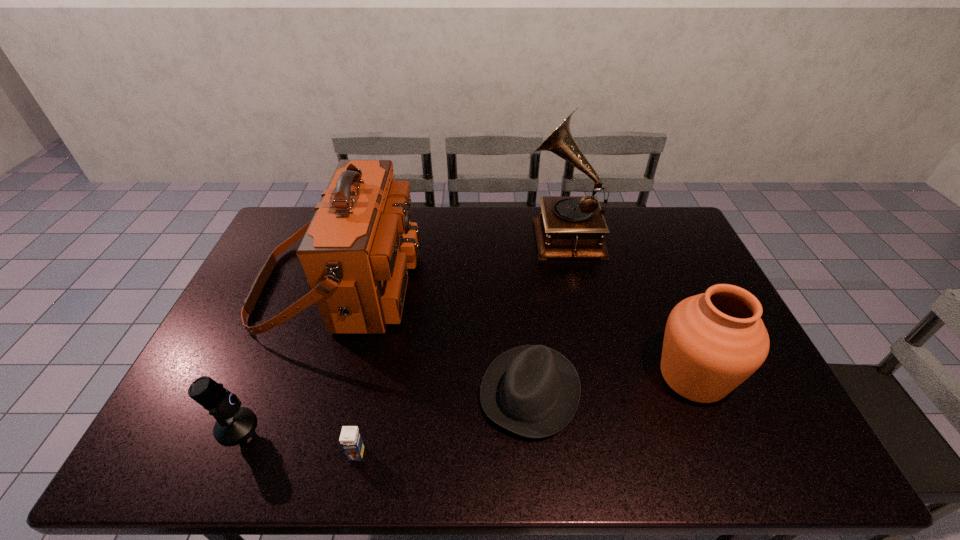
Identify the location of free space located on the face side of the satchel. The width and height of the screenshot is (960, 540). (465, 287).

Locate an element on the screen. The image size is (960, 540). free point located 0.180m on the left of the urn is located at coordinates (584, 376).

Identify the location of vacant area located 0.150m on the stand of the third shortest object. (317, 426).

Identify the location of vacant area situated 0.150m on the left of the fedora. (421, 392).

Find the location of `record player that is at the far edge`. record player that is at the far edge is located at coordinates (569, 226).

The height and width of the screenshot is (540, 960). What are the coordinates of `satchel that is at the far edge` in the screenshot? It's located at (356, 251).

Locate an element on the screen. microphone located in the near edge section of the desktop is located at coordinates (233, 423).

Identify the location of fedora positioned at the near edge. This screenshot has height=540, width=960. (533, 391).

I want to click on chocolate milk that is at the near edge, so click(x=351, y=441).

At what (x,y) coordinates should I click in order to perform the action: click on satchel that is at the left edge. Please return your answer as a coordinate pair (x, y). This screenshot has width=960, height=540. Looking at the image, I should click on (356, 251).